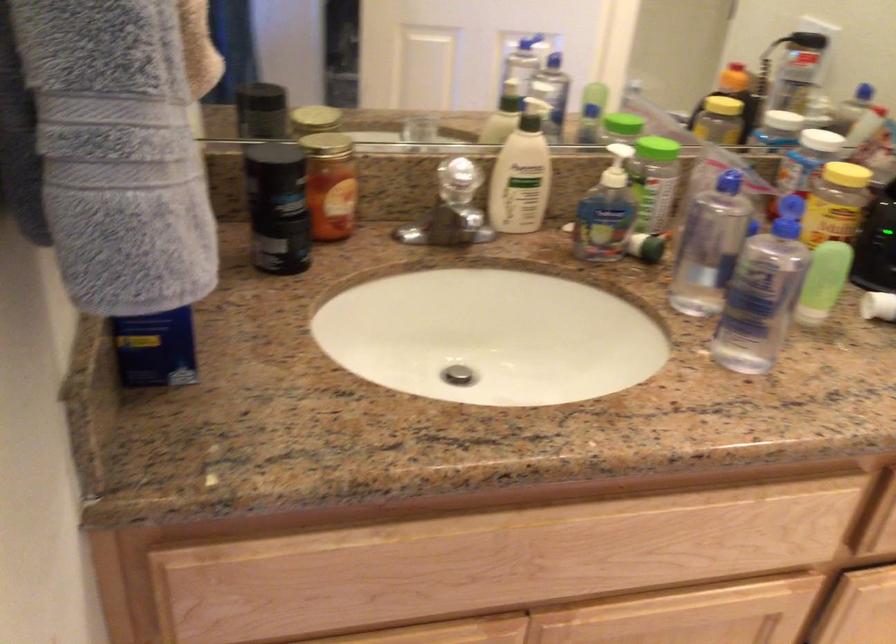
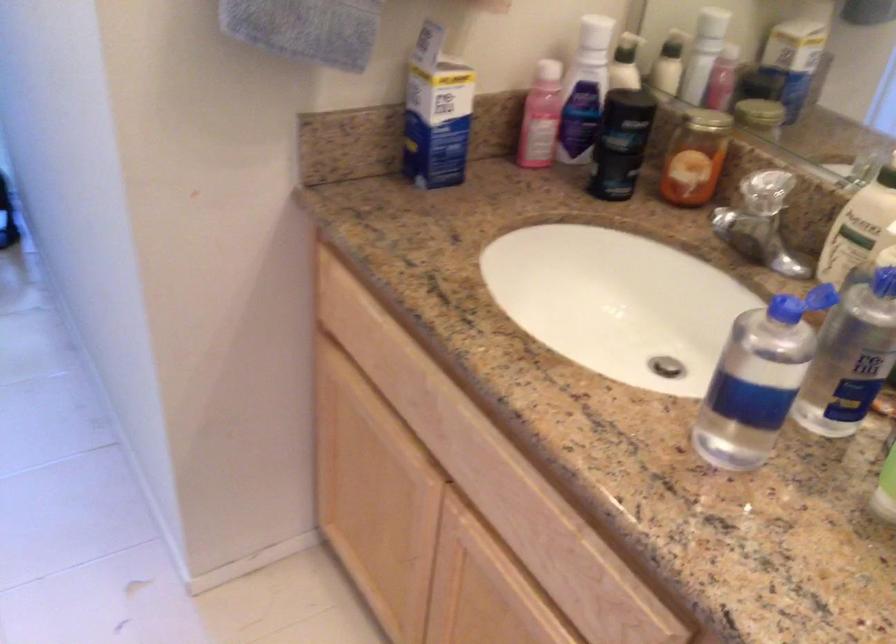
First-person continuous shooting, in which direction is the camera rotating?

The rotation direction of the camera is left-down.